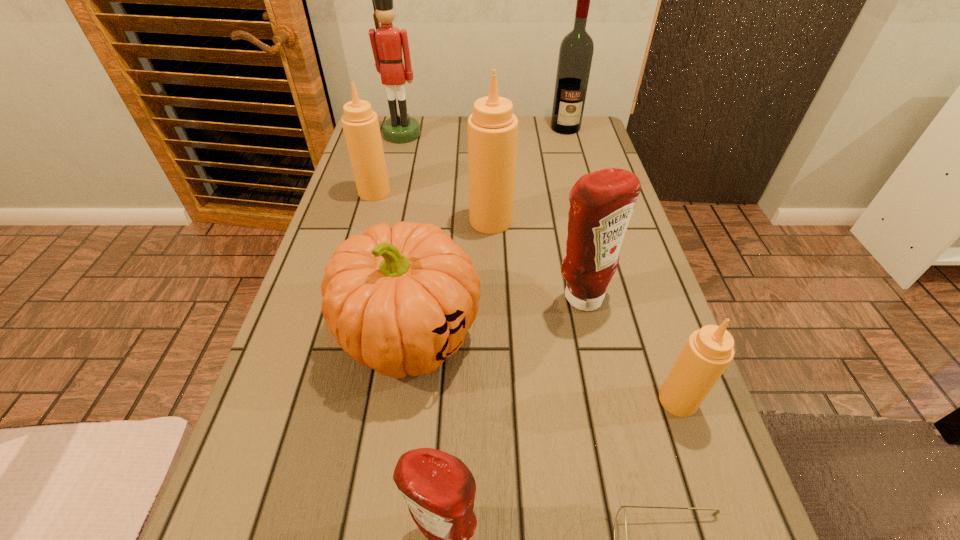
Where is `the nearest tan condiment`? This screenshot has width=960, height=540. the nearest tan condiment is located at coordinates (708, 351).

The image size is (960, 540). I want to click on free space located 0.240m on the front-facing side of the nutcracker, so click(389, 188).

I want to click on vacant space situated on the front and back of the alcohol, so click(x=582, y=187).

This screenshot has height=540, width=960. Identify the location of free space located on the front of the second farthest condiment. (492, 281).

This screenshot has height=540, width=960. Find the location of `blank space located 0.160m on the front of the leftmost tan condiment`. blank space located 0.160m on the front of the leftmost tan condiment is located at coordinates (360, 241).

Find the location of `free region located on the left of the second condiment from right to left`. free region located on the left of the second condiment from right to left is located at coordinates (506, 298).

This screenshot has width=960, height=540. What are the coordinates of `free space located on the surface of the pumpkin` in the screenshot? It's located at (384, 521).

This screenshot has height=540, width=960. What are the coordinates of `blank area located on the left of the rightmost condiment` in the screenshot? It's located at (432, 400).

Locate an element on the screen. nutcracker that is at the far edge is located at coordinates (387, 42).

Find the location of a particular element. The image size is (960, 540). alcohol that is at the far edge is located at coordinates (576, 50).